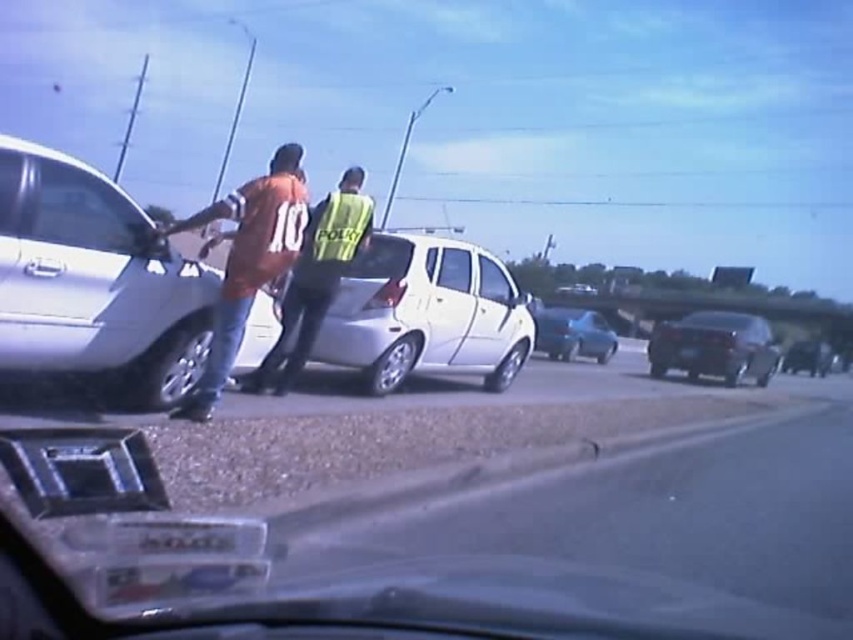
You are a driver trying to merge into the highway. You notice two metallic silver sedans ahead. The silver metallic sedan at left and the metallic silver sedan at center are in your path. Which one is wider and might require more space to safely pass around?

The metallic silver sedan at center is wider than the silver metallic sedan at left, so you should allow more space when passing around the metallic silver sedan at center.

Looking at this image, you are driving a truck that requires a minimum clearance of 2 meters to pass under. You see both the metallic silver sedan at center and the shiny black sedan at center. Which vehicle should you avoid to ensure your truck can pass through the area safely?

The metallic silver sedan at center has a greater height compared to shiny black sedan at center. Since your truck requires a minimum clearance of 2 meters, you should avoid the metallic silver sedan at center because its height might exceed the required clearance, whereas the shiny black sedan at center is shorter and may allow sufficient clearance.